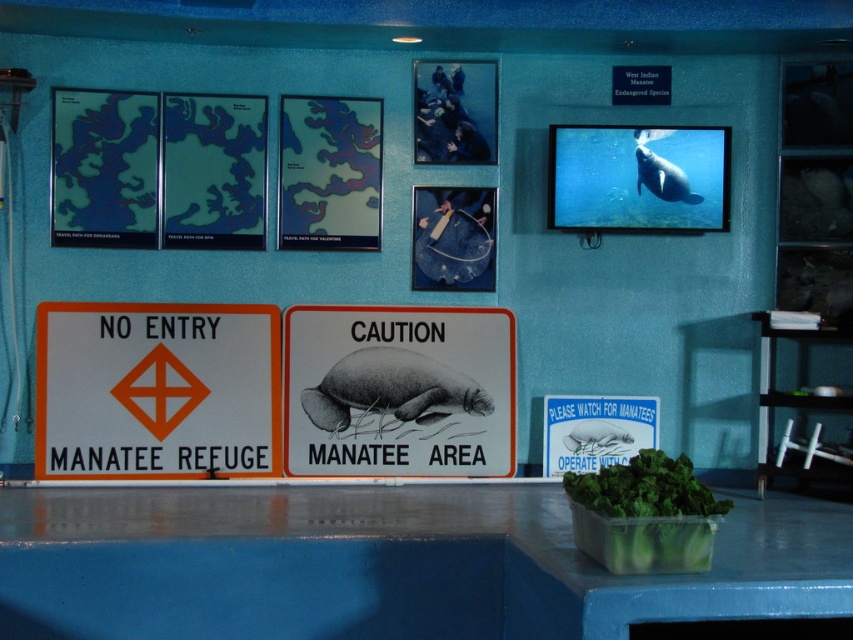
Question: Is white plastic sign at center wider than gray/black/white textured manatee at center?

Choices:
 (A) yes
 (B) no

Answer: (A)

Question: Considering the real-world distances, which object is farthest from the gray matte manatee at upper center?

Choices:
 (A) gray rubber manatee at center
 (B) white paper with black ink at center
 (C) gray/black/white textured manatee at center
 (D) white plastic sign at center

Answer: (D)

Question: Considering the relative positions of gray matte manatee at upper center and gray rubber manatee at center in the image provided, where is gray matte manatee at upper center located with respect to gray rubber manatee at center?

Choices:
 (A) right
 (B) left

Answer: (A)

Question: Can you confirm if white plastic sign at center is thinner than gray/black/white textured manatee at center?

Choices:
 (A) yes
 (B) no

Answer: (B)

Question: Among these points, which one is nearest to the camera?

Choices:
 (A) (511, 470)
 (B) (666, 164)
 (C) (167, 465)

Answer: (C)

Question: Which of the following is the farthest from the observer?

Choices:
 (A) (654, 154)
 (B) (457, 448)
 (C) (268, 371)
 (D) (584, 440)

Answer: (B)